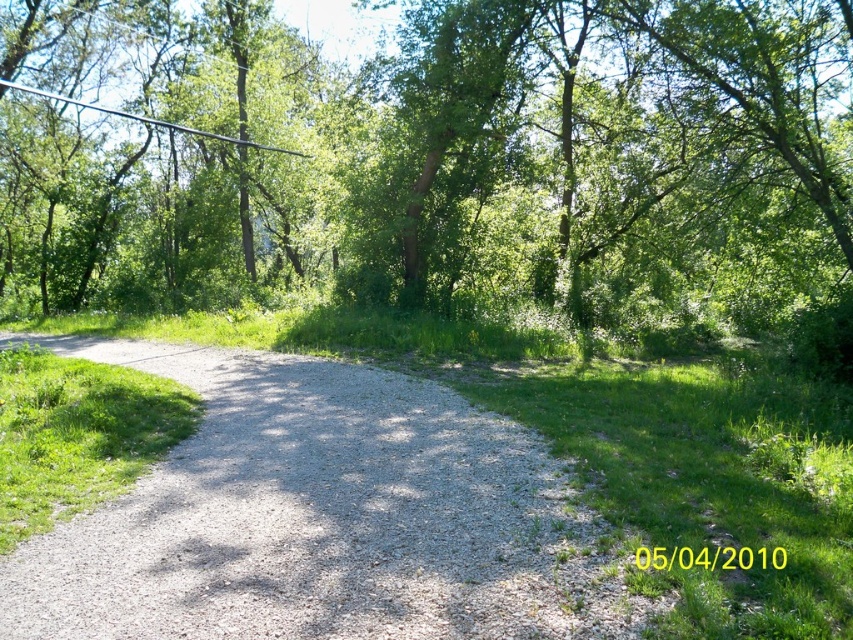
You are standing on the gravel path and want to take a photo of the green leafy tree at upper center. If your camera can focus on objects up to 10 meters away, will you need to move closer to take a clear photo?

The green leafy tree at upper center is 10.51 meters away from the viewer. Since the camera can only focus up to 10 meters, you need to move closer to ensure the tree is within the camera range.

You are a hiker standing at the starting point of the gravel path. You want to reach the green leafy tree at upper center. According to the map, your current position is at point 0,0. What direction should you head towards to reach the tree?

The green leafy tree at upper center is located at point (x=436, y=161), so you should head northeast to reach it.

You are standing at the starting point of the gravel path in the forest. You see two points marked on the path. One is at coordinates point (512, 538) and the other at point (120, 109). Which point is closer to your current position?

Point (512, 538) is closer to the camera than point (120, 109), so the point closer to your current position is point (512, 538).